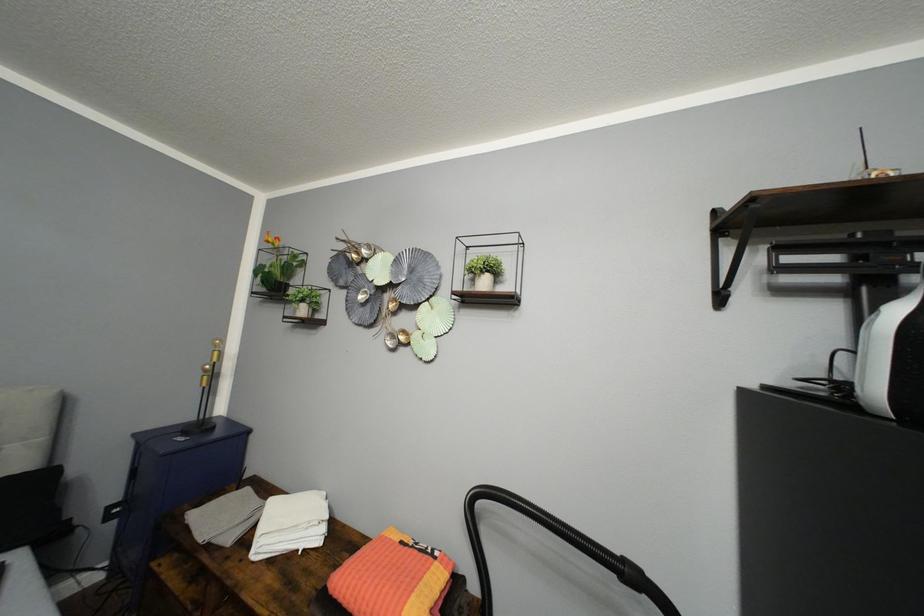
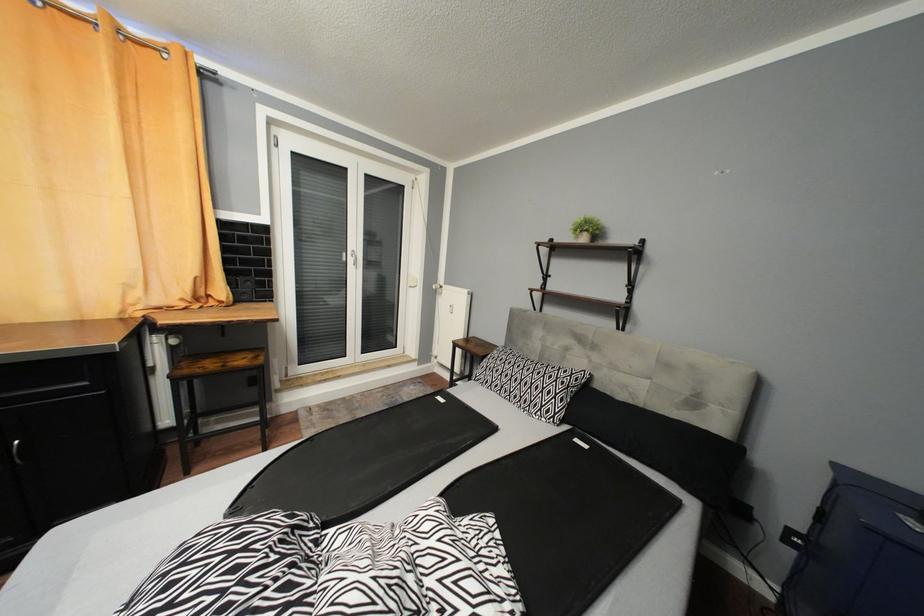
Question: The first image is from the beginning of the video and the second image is from the end. How did the camera likely rotate when shooting the video?

Choices:
 (A) Left
 (B) Right
 (C) Up
 (D) Down

Answer: (A)